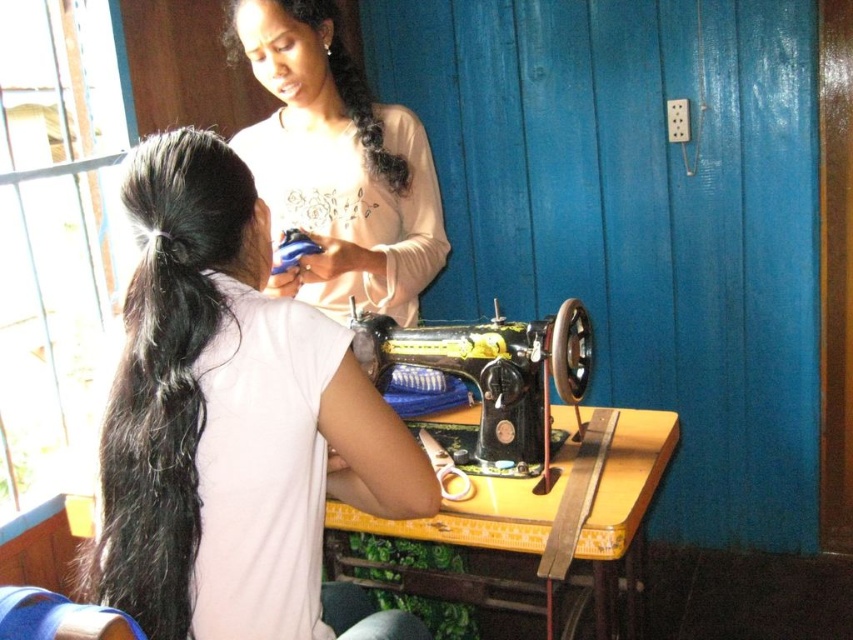
Question: Observing the image, what is the correct spatial positioning of matte white shirt at upper center in reference to yellow wood table at center?

Choices:
 (A) above
 (B) below

Answer: (A)

Question: Is matte white shirt at upper center to the left of black curly hair at upper center from the viewer's perspective?

Choices:
 (A) yes
 (B) no

Answer: (B)

Question: Among these objects, which one is nearest to the camera?

Choices:
 (A) black metal sewing machine at center
 (B) white matte shirt at upper left
 (C) yellow wood table at center
 (D) matte white shirt at upper center

Answer: (B)

Question: Which of these objects is positioned farthest from the yellow wood table at center?

Choices:
 (A) matte white shirt at upper center
 (B) white matte shirt at upper left

Answer: (A)

Question: Which object is closer to the camera taking this photo?

Choices:
 (A) matte white shirt at upper center
 (B) black curly hair at upper center
 (C) yellow wood table at center
 (D) black metal sewing machine at center

Answer: (C)

Question: Where is white matte shirt at upper left located in relation to black metal sewing machine at center in the image?

Choices:
 (A) above
 (B) below

Answer: (B)